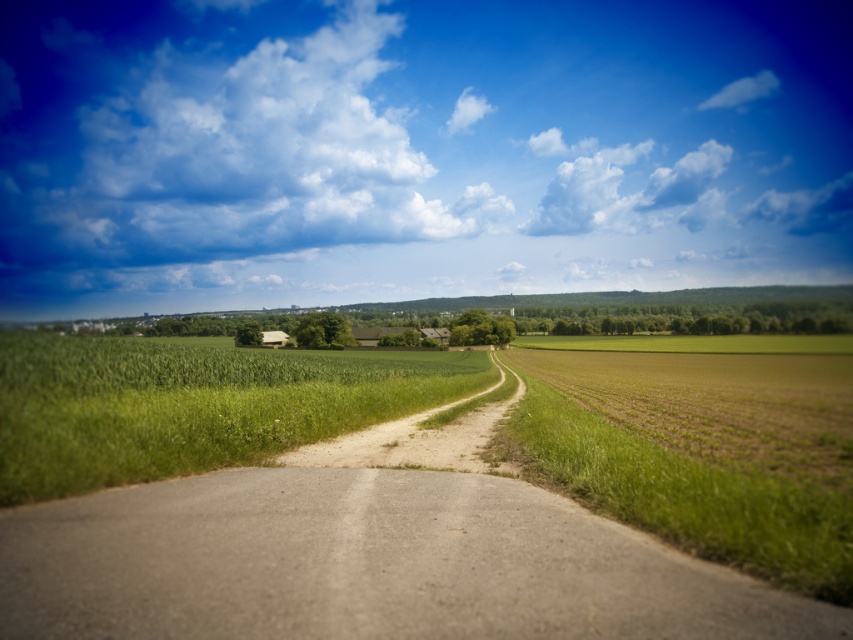
Question: Which object appears closest to the camera in this image?

Choices:
 (A) brown dirt track at center
 (B) green grassy field at center

Answer: (A)

Question: Is brown dirt track at center positioned before green grassy field at center?

Choices:
 (A) yes
 (B) no

Answer: (A)

Question: Does brown dirt track at center lie in front of green grassy field at center?

Choices:
 (A) no
 (B) yes

Answer: (B)

Question: Which of the following is the closest to the observer?

Choices:
 (A) (281, 515)
 (B) (55, 460)

Answer: (A)

Question: Among these points, which one is nearest to the camera?

Choices:
 (A) (624, 548)
 (B) (316, 432)

Answer: (A)

Question: Is brown dirt track at center above green grassy field at center?

Choices:
 (A) yes
 (B) no

Answer: (A)